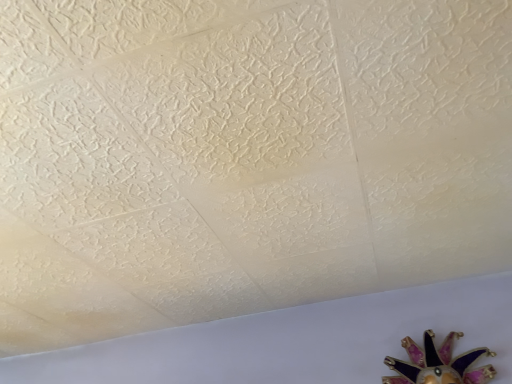
Identify the location of purple enamel flower at lower right. (438, 363).

What is the approximate width of purple enamel flower at lower right?

purple enamel flower at lower right is 5.89 inches wide.

What do you see at coordinates (438, 363) in the screenshot? I see `purple enamel flower at lower right` at bounding box center [438, 363].

The image size is (512, 384). What are the coordinates of `purple enamel flower at lower right` in the screenshot? It's located at (438, 363).